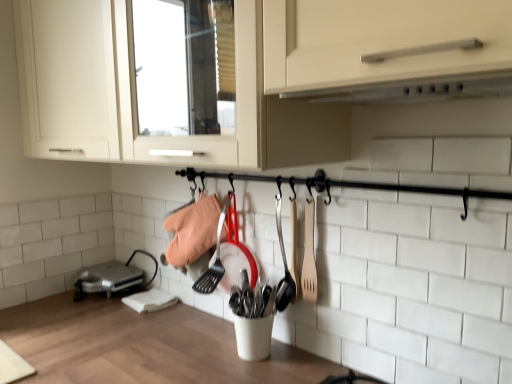
Question: Does wooden spatula at center-right appear on the right side of white matte exhaust hood at upper center?

Choices:
 (A) no
 (B) yes

Answer: (A)

Question: Can you confirm if wooden spatula at center-right is positioned to the left of white matte exhaust hood at upper center?

Choices:
 (A) yes
 (B) no

Answer: (A)

Question: Is wooden spatula at center-right not near white matte exhaust hood at upper center?

Choices:
 (A) no
 (B) yes

Answer: (A)

Question: Is wooden spatula at center-right positioned behind white matte exhaust hood at upper center?

Choices:
 (A) yes
 (B) no

Answer: (A)

Question: From a real-world perspective, is wooden spatula at center-right located beneath white matte exhaust hood at upper center?

Choices:
 (A) no
 (B) yes

Answer: (B)

Question: Is white matte exhaust hood at upper center a part of wooden spatula at center-right?

Choices:
 (A) yes
 (B) no

Answer: (B)

Question: Does white wood countertop at center have a lesser width compared to silver metallic toaster at lower left?

Choices:
 (A) yes
 (B) no

Answer: (B)

Question: Considering the relative sizes of white wood countertop at center and silver metallic toaster at lower left in the image provided, is white wood countertop at center bigger than silver metallic toaster at lower left?

Choices:
 (A) no
 (B) yes

Answer: (B)

Question: Is white wood countertop at center in contact with silver metallic toaster at lower left?

Choices:
 (A) yes
 (B) no

Answer: (B)

Question: From the image's perspective, is white wood countertop at center below silver metallic toaster at lower left?

Choices:
 (A) no
 (B) yes

Answer: (B)

Question: From the image's perspective, is white wood countertop at center on silver metallic toaster at lower left?

Choices:
 (A) yes
 (B) no

Answer: (B)

Question: Is white wood countertop at center positioned with its back to silver metallic toaster at lower left?

Choices:
 (A) no
 (B) yes

Answer: (A)

Question: Is wooden spatula at center-right not close to wooden spoon at center-right?

Choices:
 (A) yes
 (B) no

Answer: (B)